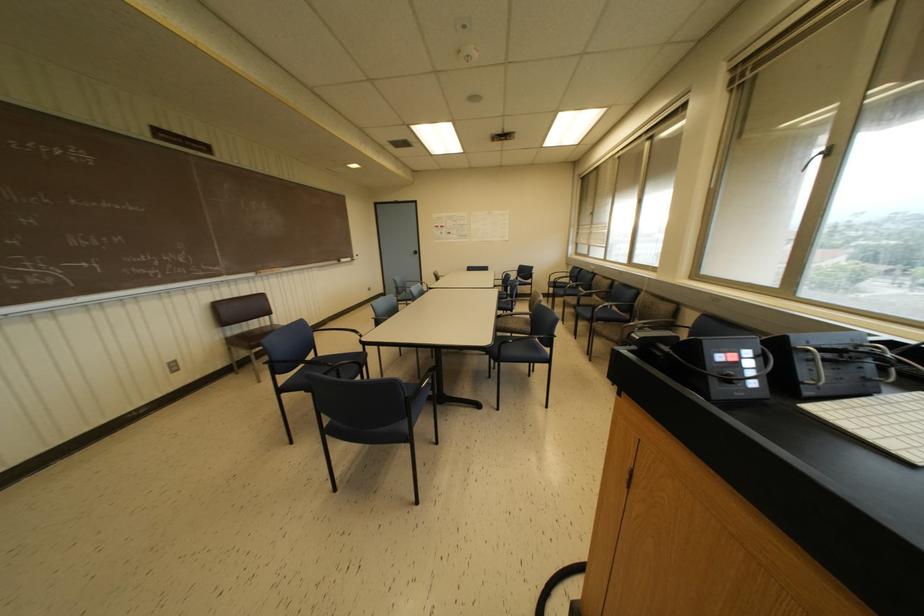
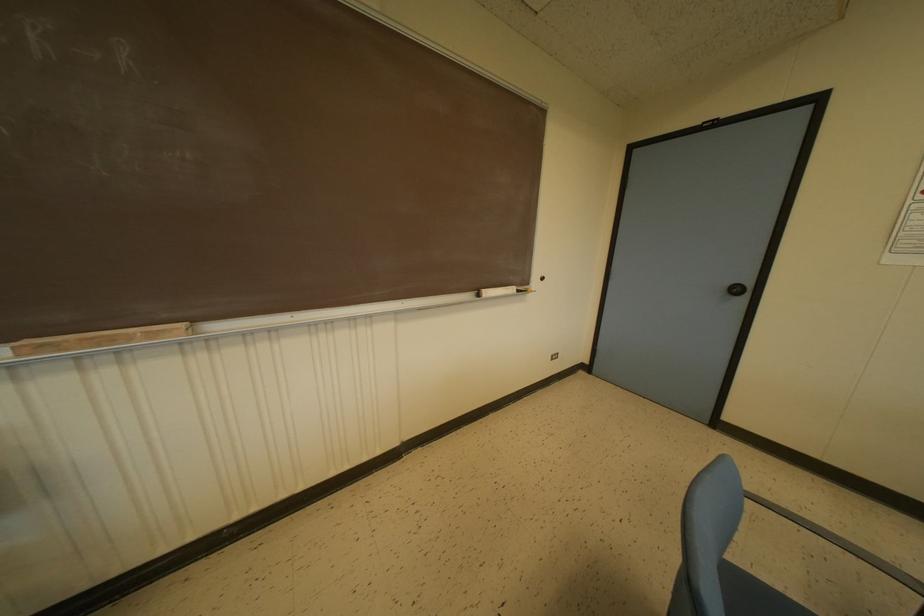
Find the pixel in the second image that matches (x=342, y=259) in the first image.

(487, 292)